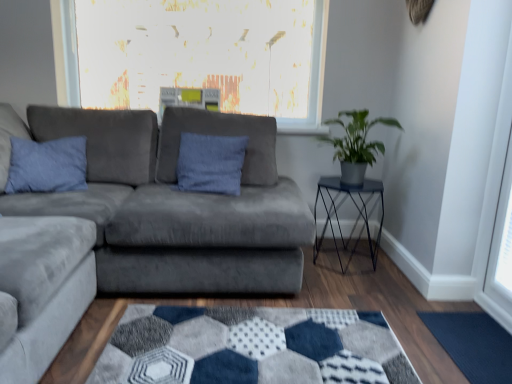
Question: From a real-world perspective, is dark blue textured mat at lower right located beneath suede gray couch at center?

Choices:
 (A) no
 (B) yes

Answer: (B)

Question: Can you confirm if dark blue textured mat at lower right is positioned to the left of suede gray couch at center?

Choices:
 (A) no
 (B) yes

Answer: (A)

Question: Is dark blue textured mat at lower right bigger than suede gray couch at center?

Choices:
 (A) no
 (B) yes

Answer: (A)

Question: Does dark blue textured mat at lower right have a lesser height compared to suede gray couch at center?

Choices:
 (A) yes
 (B) no

Answer: (A)

Question: From a real-world perspective, is dark blue textured mat at lower right located higher than suede gray couch at center?

Choices:
 (A) yes
 (B) no

Answer: (B)

Question: From their relative heights in the image, would you say metallic black table at right is taller or shorter than blue suede pillow at left?

Choices:
 (A) tall
 (B) short

Answer: (A)

Question: Is metallic black table at right spatially inside blue suede pillow at left, or outside of it?

Choices:
 (A) inside
 (B) outside

Answer: (B)

Question: From a real-world perspective, is metallic black table at right physically located above or below blue suede pillow at left?

Choices:
 (A) above
 (B) below

Answer: (B)

Question: Relative to blue suede pillow at left, is metallic black table at right in front or behind?

Choices:
 (A) behind
 (B) front

Answer: (A)

Question: Is blue suede pillow at left in front of or behind metallic black table at right in the image?

Choices:
 (A) behind
 (B) front

Answer: (B)

Question: Looking at their shapes, would you say blue suede pillow at left is wider or thinner than metallic black table at right?

Choices:
 (A) wide
 (B) thin

Answer: (B)

Question: From a real-world perspective, is blue suede pillow at left positioned above or below metallic black table at right?

Choices:
 (A) below
 (B) above

Answer: (B)

Question: From the image's perspective, is blue suede pillow at left located above or below metallic black table at right?

Choices:
 (A) below
 (B) above

Answer: (B)

Question: Considering the positions of metallic black table at right and green matte plant at right in the image, is metallic black table at right wider or thinner than green matte plant at right?

Choices:
 (A) wide
 (B) thin

Answer: (A)

Question: Choose the correct answer: Is metallic black table at right inside green matte plant at right or outside it?

Choices:
 (A) outside
 (B) inside

Answer: (A)